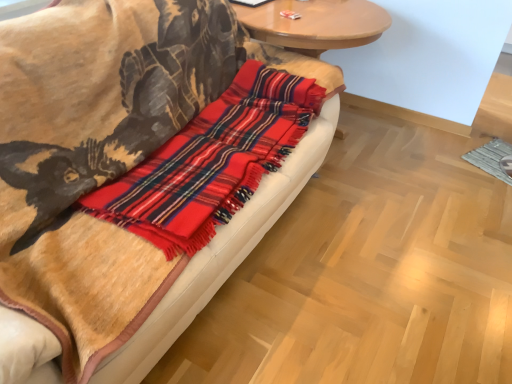
Question: Can you confirm if plaid wool blanket at center is smaller than red plaid flannel at center?

Choices:
 (A) no
 (B) yes

Answer: (A)

Question: From the image's perspective, is plaid wool blanket at center under red plaid flannel at center?

Choices:
 (A) no
 (B) yes

Answer: (B)

Question: From the image's perspective, is plaid wool blanket at center above red plaid flannel at center?

Choices:
 (A) yes
 (B) no

Answer: (B)

Question: Considering the relative sizes of plaid wool blanket at center and red plaid flannel at center in the image provided, is plaid wool blanket at center thinner than red plaid flannel at center?

Choices:
 (A) yes
 (B) no

Answer: (B)

Question: From a real-world perspective, does plaid wool blanket at center sit lower than red plaid flannel at center?

Choices:
 (A) no
 (B) yes

Answer: (B)

Question: From a real-world perspective, is wooden round table at upper center positioned above or below plaid wool blanket at center?

Choices:
 (A) above
 (B) below

Answer: (B)

Question: In terms of width, does wooden round table at upper center look wider or thinner when compared to plaid wool blanket at center?

Choices:
 (A) wide
 (B) thin

Answer: (A)

Question: Is wooden round table at upper center taller or shorter than plaid wool blanket at center?

Choices:
 (A) tall
 (B) short

Answer: (B)

Question: In terms of size, does wooden round table at upper center appear bigger or smaller than plaid wool blanket at center?

Choices:
 (A) big
 (B) small

Answer: (B)

Question: From a real-world perspective, is red plaid flannel at center positioned above or below wooden round table at upper center?

Choices:
 (A) below
 (B) above

Answer: (B)

Question: From the image's perspective, relative to wooden round table at upper center, is red plaid flannel at center above or below?

Choices:
 (A) below
 (B) above

Answer: (A)

Question: Does point (125, 195) appear closer or farther from the camera than point (274, 3)?

Choices:
 (A) farther
 (B) closer

Answer: (B)

Question: Is red plaid flannel at center in front of or behind wooden round table at upper center in the image?

Choices:
 (A) behind
 (B) front

Answer: (B)

Question: From their relative heights in the image, would you say plaid wool blanket at center is taller or shorter than red plaid flannel at center?

Choices:
 (A) tall
 (B) short

Answer: (A)

Question: From the image's perspective, is plaid wool blanket at center above or below red plaid flannel at center?

Choices:
 (A) below
 (B) above

Answer: (A)